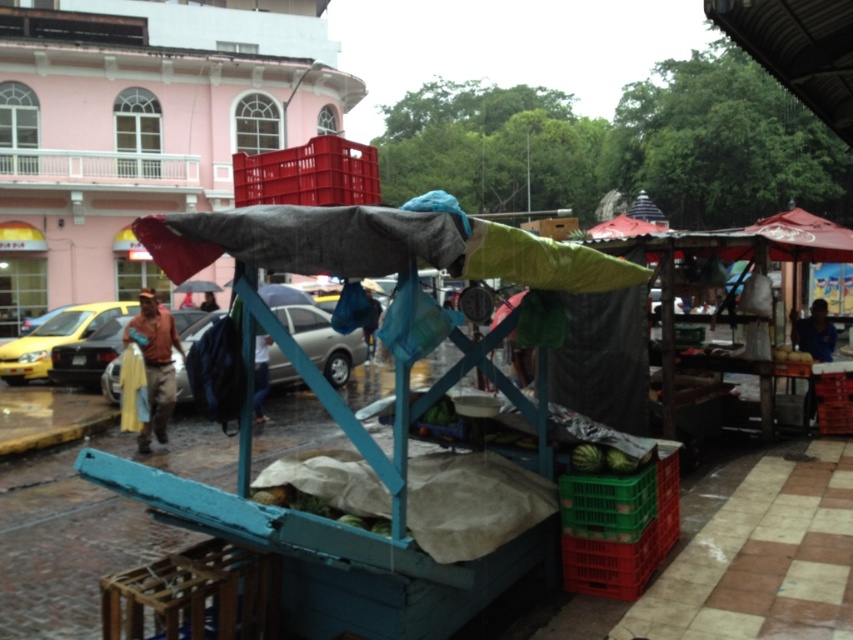
Question: Which point appears farthest from the camera in this image?

Choices:
 (A) (169, 349)
 (B) (96, 364)
 (C) (67, 333)

Answer: (C)

Question: Is metallic silver car at center thinner than brown leather jacket at center?

Choices:
 (A) yes
 (B) no

Answer: (B)

Question: Is metallic silver car at center below metallic silver car at left?

Choices:
 (A) yes
 (B) no

Answer: (B)

Question: Which point appears closest to the camera in this image?

Choices:
 (A) (1, 364)
 (B) (306, 348)
 (C) (169, 349)

Answer: (C)

Question: Does matte plastic crate at upper center have a smaller size compared to yellow matte taxi at left?

Choices:
 (A) yes
 (B) no

Answer: (B)

Question: Which point appears closest to the camera in this image?

Choices:
 (A) (337, 369)
 (B) (165, 429)

Answer: (B)